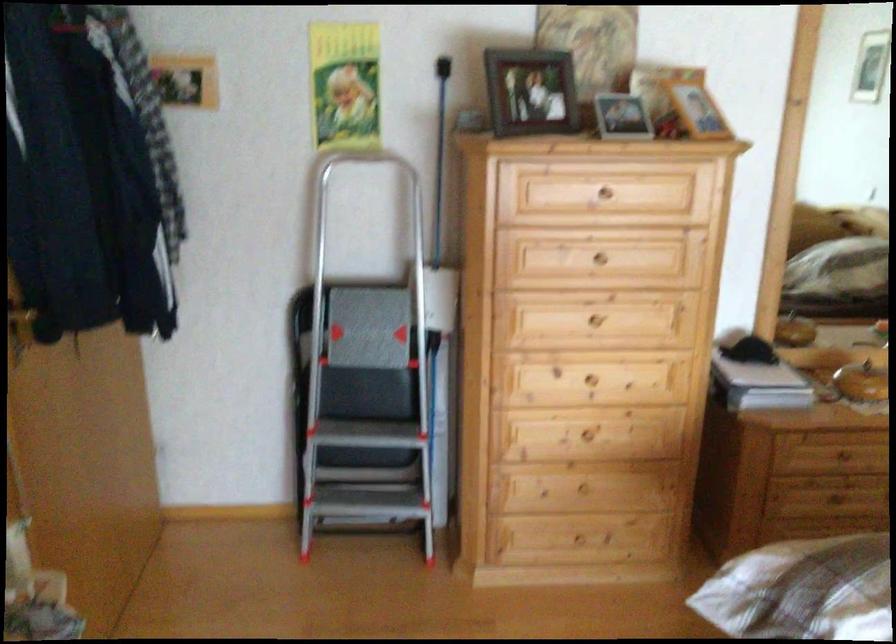
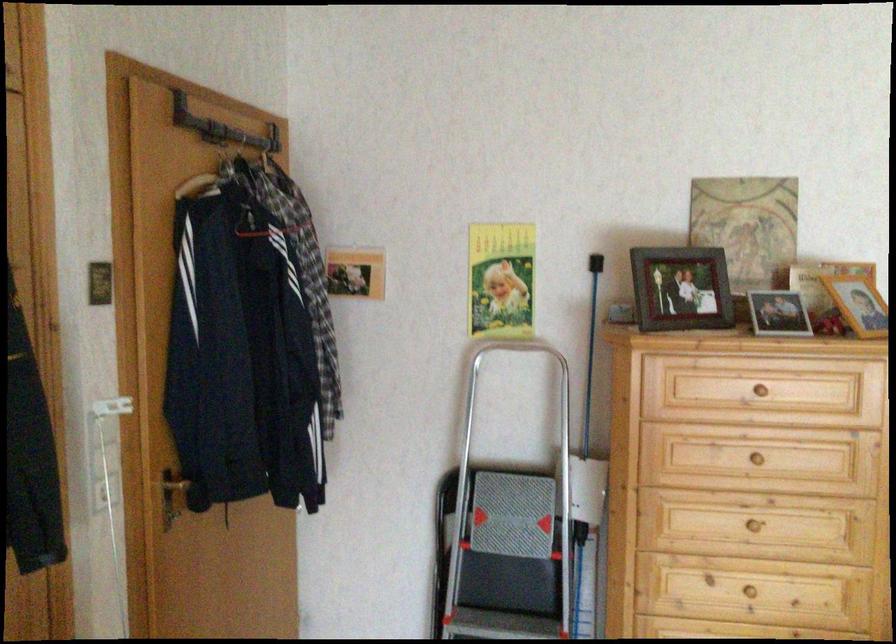
Where in the second image is the point corresponding to point (438, 301) from the first image?

(588, 489)